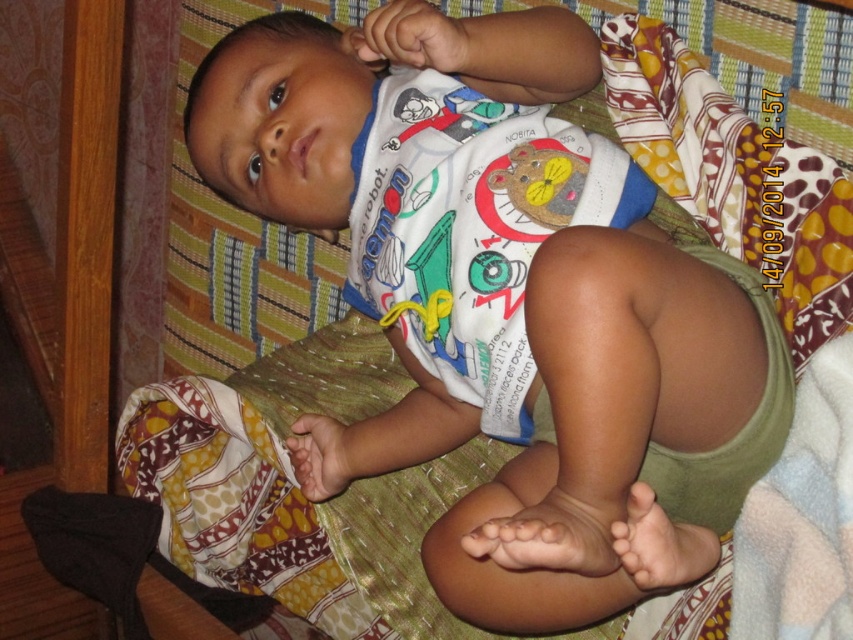
You are a parent looking at your baby wearing both the white cotton onesie at center and the white cotton bib at center. Which clothing item is larger?

The white cotton onesie at center is bigger than the white cotton bib at center, so the onesie is larger.

In the scene shown: You are a photographer taking a picture of the baby. You notice both the white cotton onesie at center and the white cotton bib at center. Which one should you focus on to ensure the foreground is sharp?

The white cotton onesie at center is closer to the viewer than the white cotton bib at center, so focusing on the onesie will keep it sharp in the foreground while the bib may appear slightly blurred.